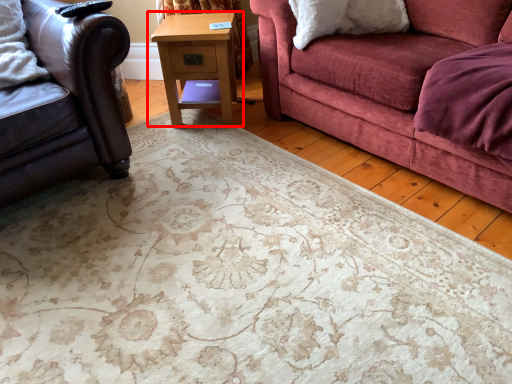
Question: From the image's perspective, where is table (annotated by the red box) located relative to studio couch?

Choices:
 (A) below
 (B) above

Answer: (B)